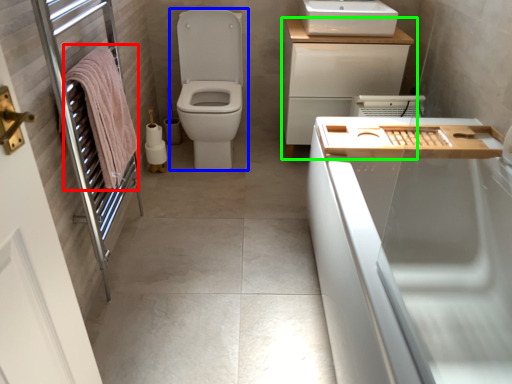
Question: Estimate the real-world distances between objects in this image. Which object is farther from bath towel (highlighted by a red box), toilet (highlighted by a blue box) or bathroom cabinet (highlighted by a green box)?

Choices:
 (A) toilet
 (B) bathroom cabinet

Answer: (B)